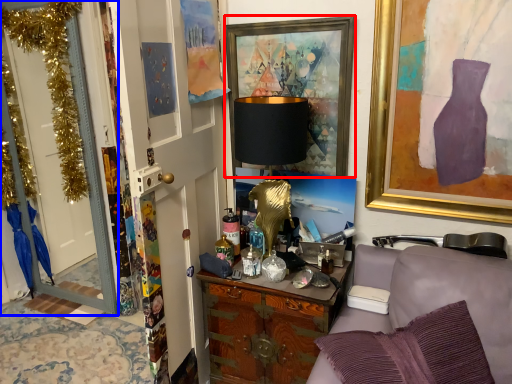
Question: Which point is closer to the camera, picture frame (highlighted by a red box) or door (highlighted by a blue box)?

Choices:
 (A) picture frame
 (B) door

Answer: (A)